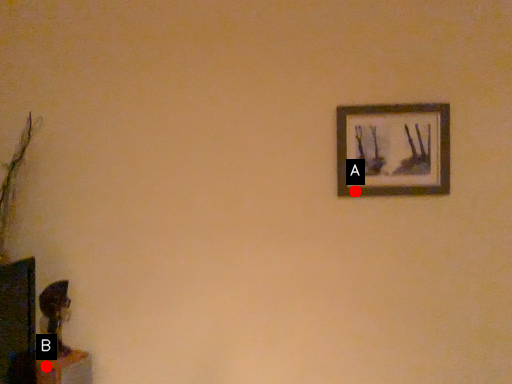
Question: Two points are circled on the image, labeled by A and B beside each circle. Which point is closer to the camera taking this photo?

Choices:
 (A) A is closer
 (B) B is closer

Answer: (B)